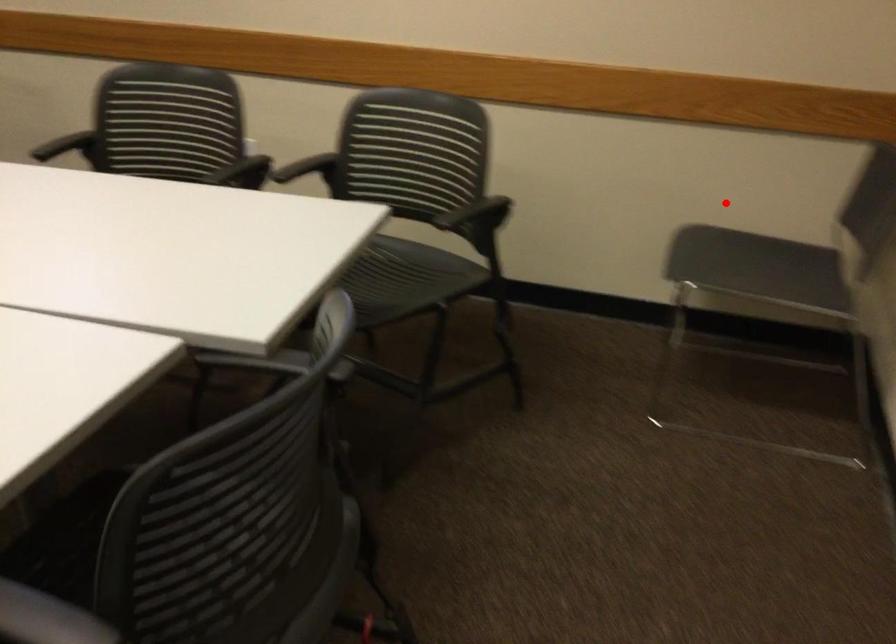
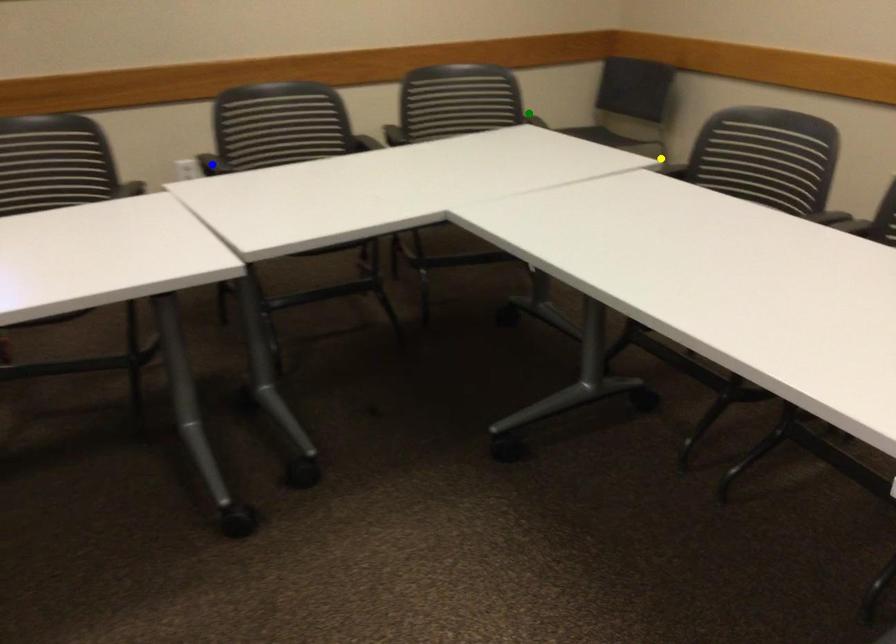
Question: I am providing you with two images of the same scene from different viewpoints. A red point is marked on the first image. You are given multiple points on the second image. Can you choose the point in image 2 that corresponds to the point in image 1?

Choices:
 (A) green point
 (B) yellow point
 (C) blue point

Answer: (A)